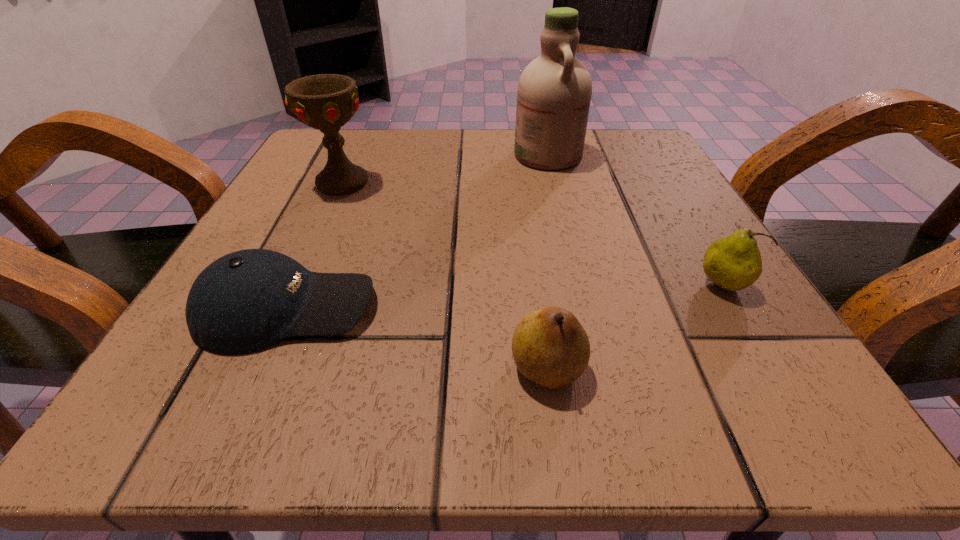
What are the coordinates of `free space between the shortest object and the second tallest object` in the screenshot? It's located at (315, 245).

Find the location of a particular element. The height and width of the screenshot is (540, 960). empty location between the left pear and the cleansing agent is located at coordinates click(547, 261).

Locate an element on the screen. unoccupied area between the chalice and the cleansing agent is located at coordinates (445, 168).

Find the location of a particular element. This screenshot has height=540, width=960. blank region between the left pear and the baseball cap is located at coordinates (417, 338).

Where is `unoccupied area between the shortest object and the chalice`? unoccupied area between the shortest object and the chalice is located at coordinates (315, 245).

The height and width of the screenshot is (540, 960). In order to click on free spot between the left pear and the second tallest object in this screenshot , I will do `click(445, 275)`.

At what (x,y) coordinates should I click in order to perform the action: click on unoccupied area between the fourth shortest object and the cleansing agent. Please return your answer as a coordinate pair (x, y). Image resolution: width=960 pixels, height=540 pixels. Looking at the image, I should click on (445, 168).

I want to click on free space that is in between the second tallest object and the farther pear, so click(532, 234).

I want to click on free space between the shortest object and the second tallest object, so click(x=315, y=245).

Where is `object that is the third closest one to the tallest object`? object that is the third closest one to the tallest object is located at coordinates [245, 301].